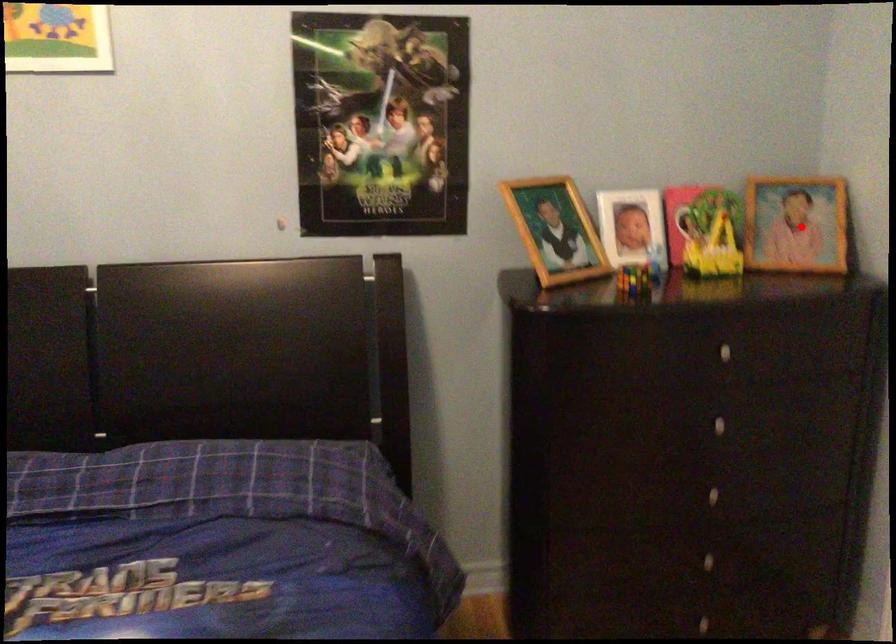
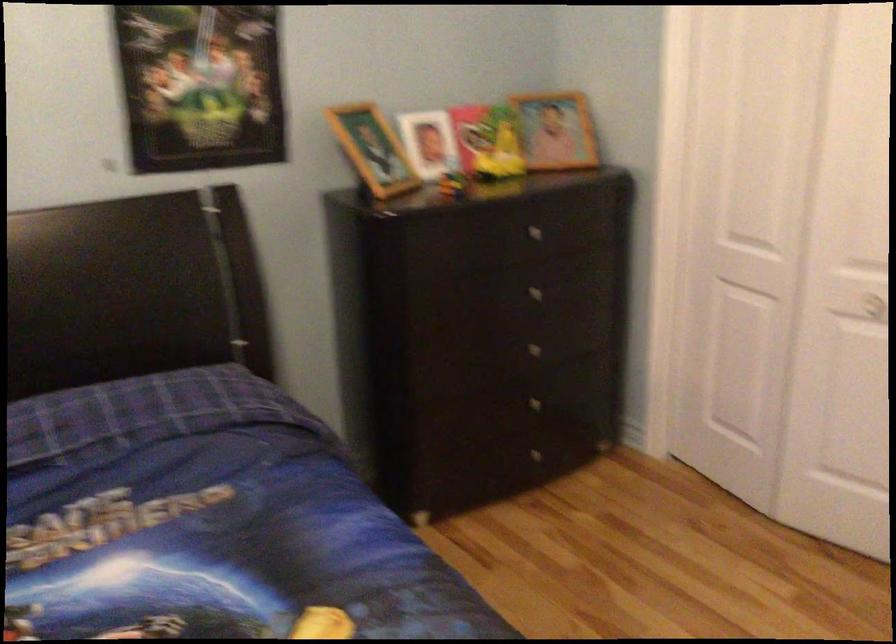
Question: A red point is marked in image1. In image2, is the corresponding 3D point closer to the camera or farther? Reply with the corresponding letter.

Choices:
 (A) The corresponding 3D point is closer.
 (B) The corresponding 3D point is farther.

Answer: (B)